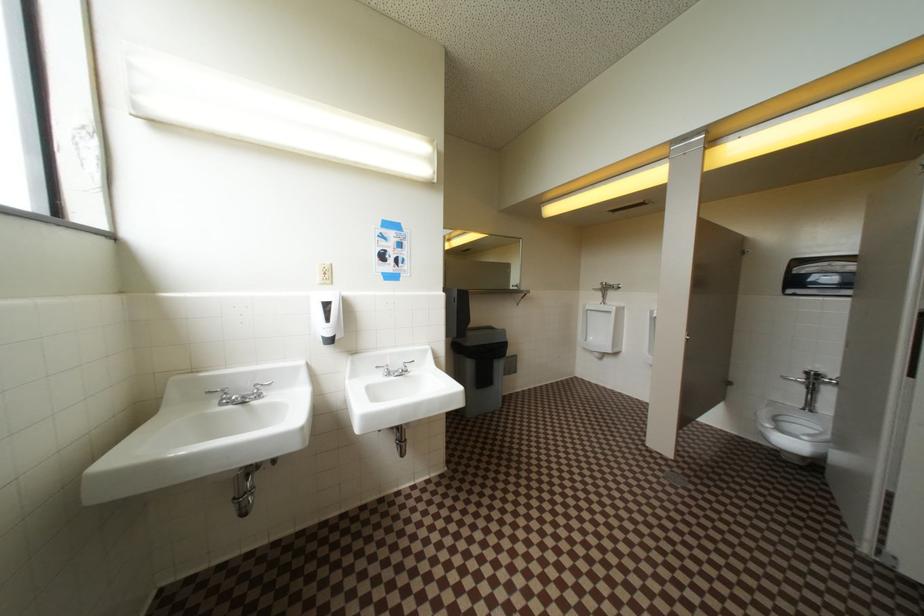
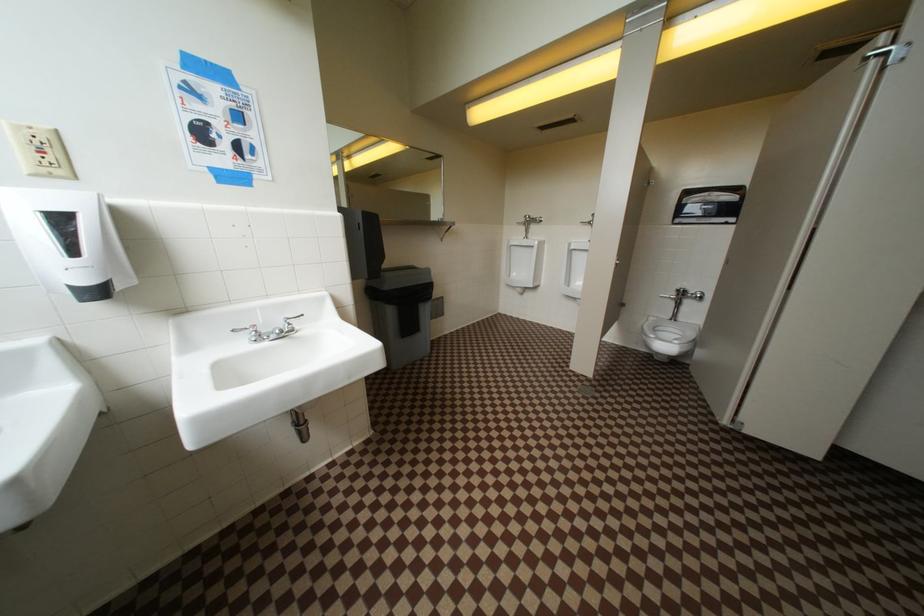
Question: The camera is either moving clockwise (left) or counter-clockwise (right) around the object. The first image is from the beginning of the video and the second image is from the end. Is the camera moving left or right when shooting the video?

Choices:
 (A) Left
 (B) Right

Answer: (A)